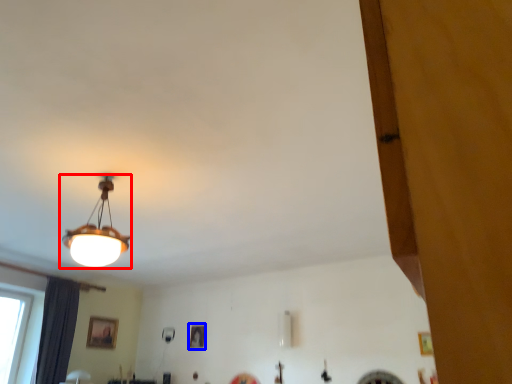
Question: Which object is further to the camera taking this photo, lamp (highlighted by a red box) or picture frame (highlighted by a blue box)?

Choices:
 (A) lamp
 (B) picture frame

Answer: (B)